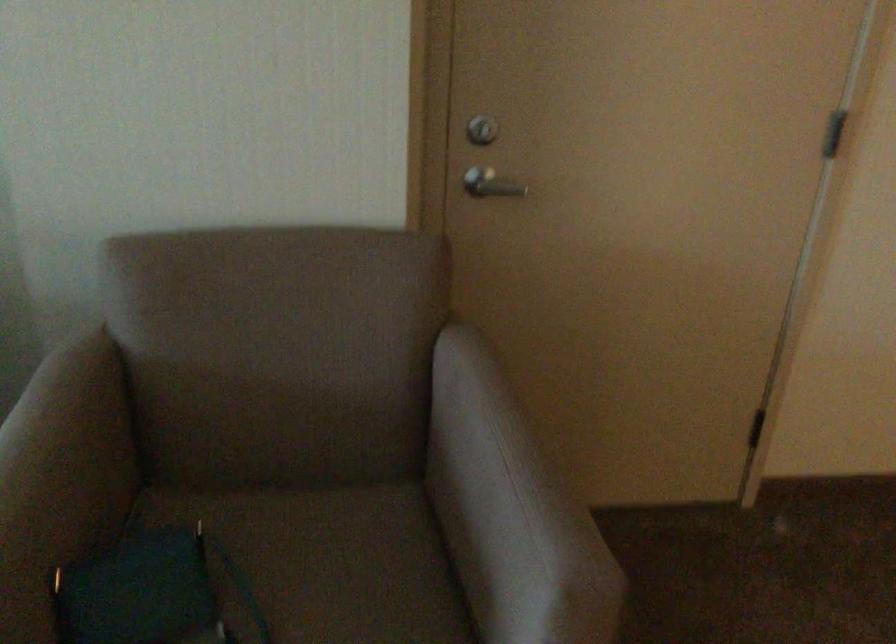
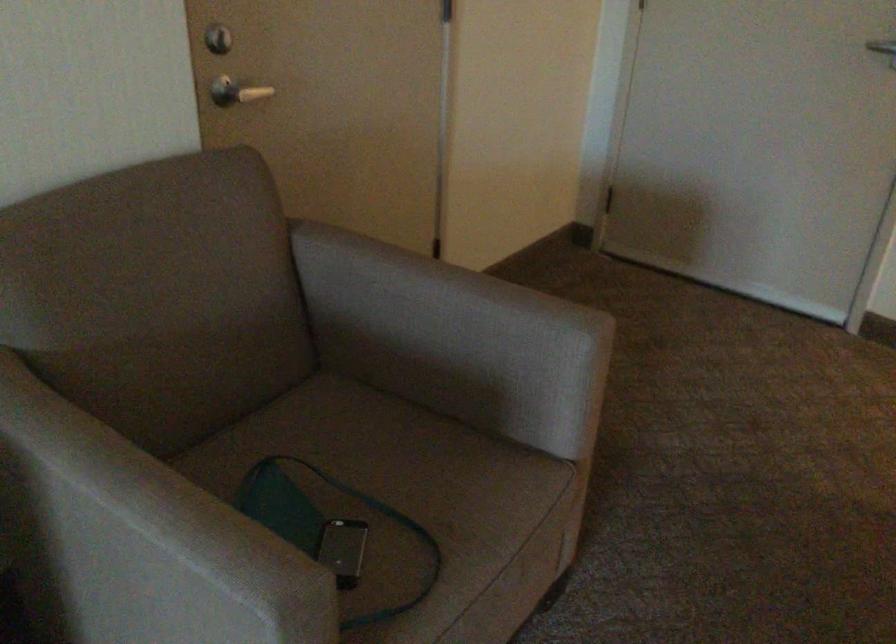
Locate, in the second image, the point that corresponds to pixel 478 185 in the first image.

(236, 91)